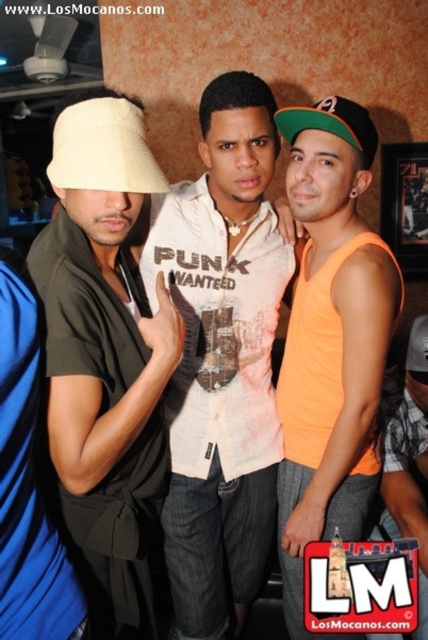
Question: Does matte beige hat at left have a larger size compared to orange fabric tank top at center?

Choices:
 (A) no
 (B) yes

Answer: (B)

Question: Which point is farther from the camera taking this photo?

Choices:
 (A) (406, 368)
 (B) (344, 451)
 (C) (95, 131)
 (D) (112, 131)

Answer: (A)

Question: Does matte beige hat at left have a smaller size compared to green fabric baseball cap at upper center?

Choices:
 (A) yes
 (B) no

Answer: (B)

Question: Based on their relative distances, which object is farther from the orange fabric tank top at center?

Choices:
 (A) orange fabric baseball cap at center
 (B) green fabric baseball cap at upper center
 (C) orange fabric tank top at right

Answer: (B)

Question: Can you confirm if orange fabric tank top at right is thinner than orange fabric tank top at center?

Choices:
 (A) yes
 (B) no

Answer: (B)

Question: Among these points, which one is farthest from the camera?

Choices:
 (A) (419, 342)
 (B) (324, 198)

Answer: (A)